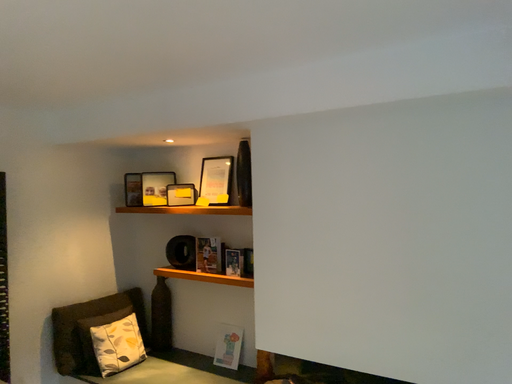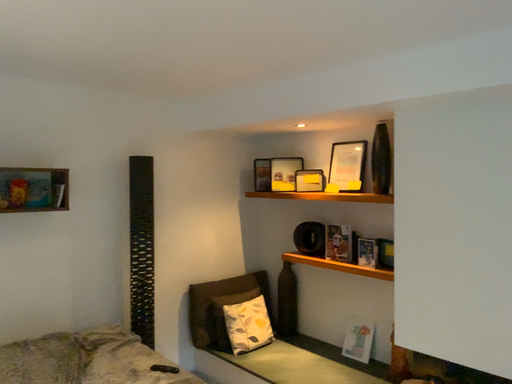
Question: Which way did the camera rotate in the video?

Choices:
 (A) rotated left
 (B) rotated right

Answer: (A)